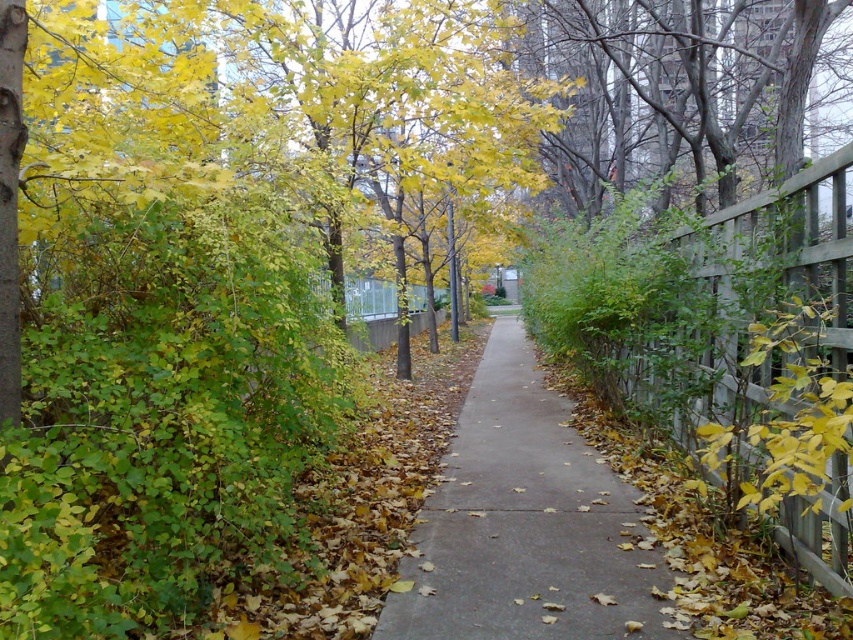
Which of these two, gray concrete sidewalk at center or wooden fence at right, stands taller?

wooden fence at right is taller.

Is gray concrete sidewalk at center to the left of wooden fence at right from the viewer's perspective?

Yes, gray concrete sidewalk at center is to the left of wooden fence at right.

Does point (558, 560) come closer to viewer compared to point (842, 548)?

No, (558, 560) is behind (842, 548).

Identify the location of gray concrete sidewalk at center. (525, 524).